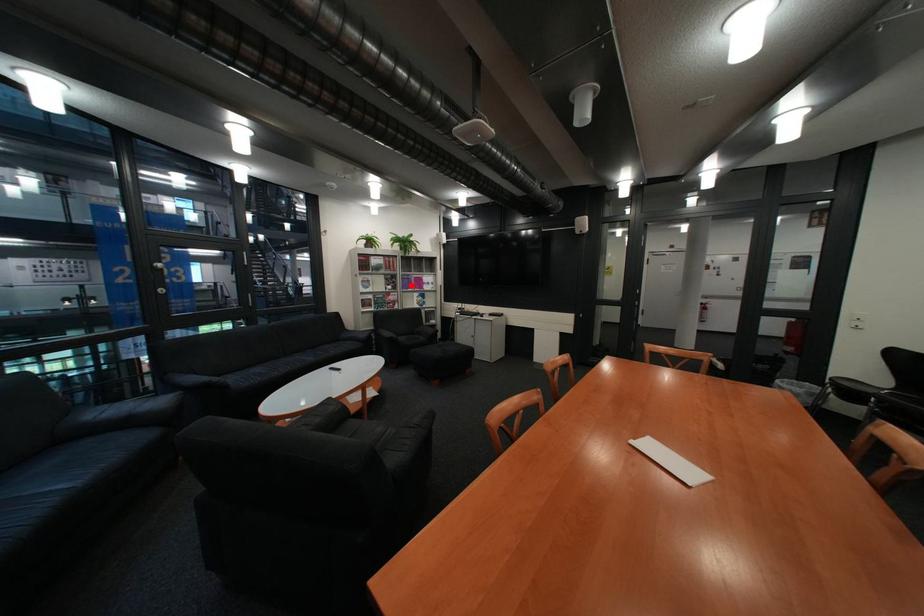
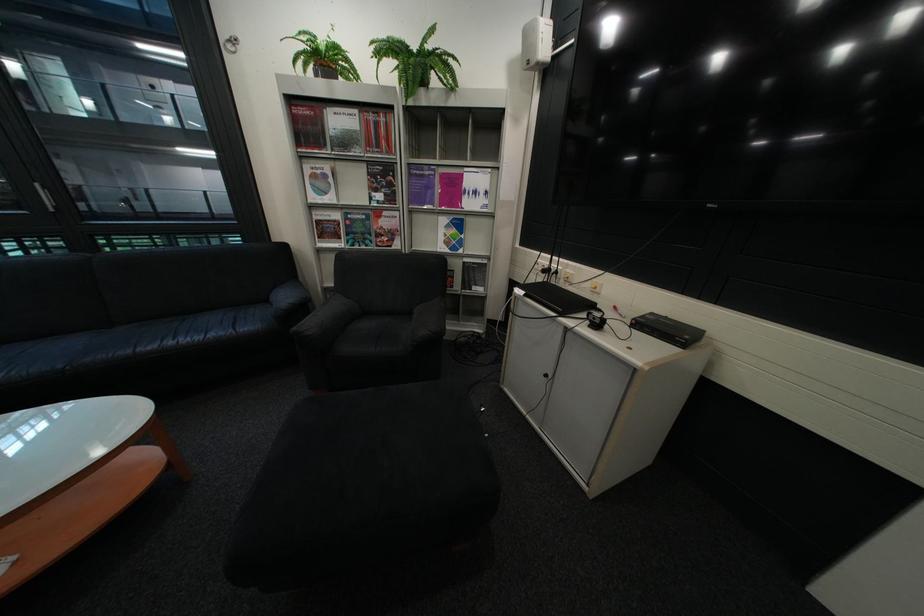
The point at the highlighted location is marked in the first image. Where is the corresponding point in the second image?

(409, 192)